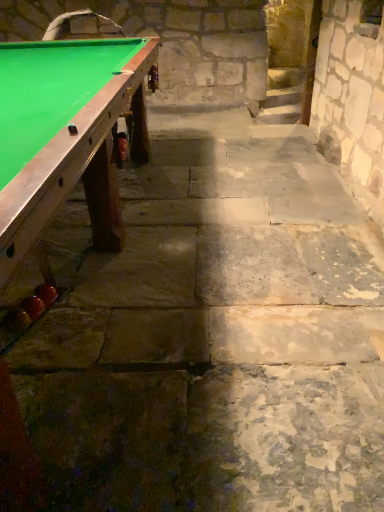
The image size is (384, 512). What do you see at coordinates (66, 135) in the screenshot? I see `green felt pool table at left` at bounding box center [66, 135].

Where is `green felt pool table at left`? The height and width of the screenshot is (512, 384). green felt pool table at left is located at coordinates (66, 135).

Where is `green felt pool table at left`? The width and height of the screenshot is (384, 512). green felt pool table at left is located at coordinates (66, 135).